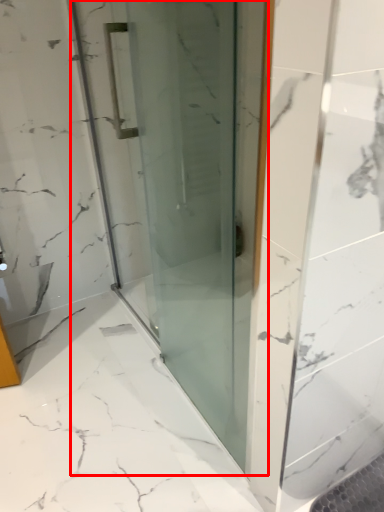
Question: From the image's perspective, where is door (annotated by the red box) located relative to bath?

Choices:
 (A) above
 (B) below

Answer: (A)